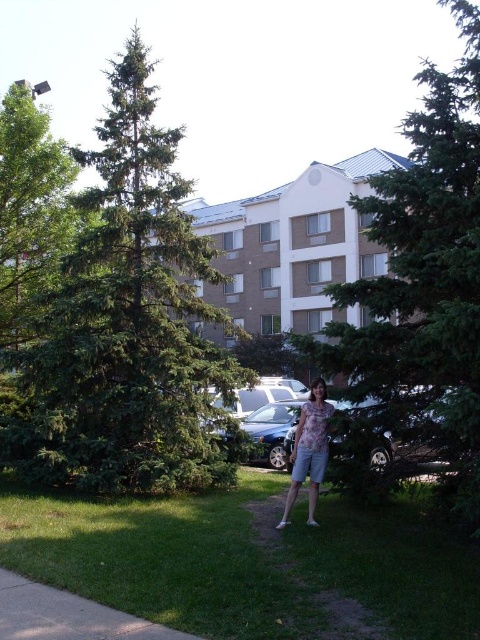
In the scene shown: Is the position of green leafy tree at upper left less distant than that of gray concrete sidewalk at lower left?

No.

Can you confirm if green leafy tree at upper left is positioned above gray concrete sidewalk at lower left?

Yes, green leafy tree at upper left is above gray concrete sidewalk at lower left.

Where is `green leafy tree at upper left`? green leafy tree at upper left is located at coordinates (31, 211).

The height and width of the screenshot is (640, 480). What do you see at coordinates (423, 284) in the screenshot?
I see `green needle-like tree at center` at bounding box center [423, 284].

Who is higher up, green needle-like tree at center or green leafy tree at upper left?

green leafy tree at upper left is above.

This screenshot has width=480, height=640. Describe the element at coordinates (423, 284) in the screenshot. I see `green needle-like tree at center` at that location.

Find the location of a particular element. This screenshot has width=480, height=640. green needle-like tree at center is located at coordinates (423, 284).

Is green needle-like at left shorter than green grass at lower center?

In fact, green needle-like at left may be taller than green grass at lower center.

From the picture: Is green needle-like at left to the left of green grass at lower center from the viewer's perspective?

Yes, green needle-like at left is to the left of green grass at lower center.

Image resolution: width=480 pixels, height=640 pixels. I want to click on green needle-like at left, so click(x=128, y=324).

Find the location of a particular element. This screenshot has height=640, width=480. green needle-like at left is located at coordinates (128, 324).